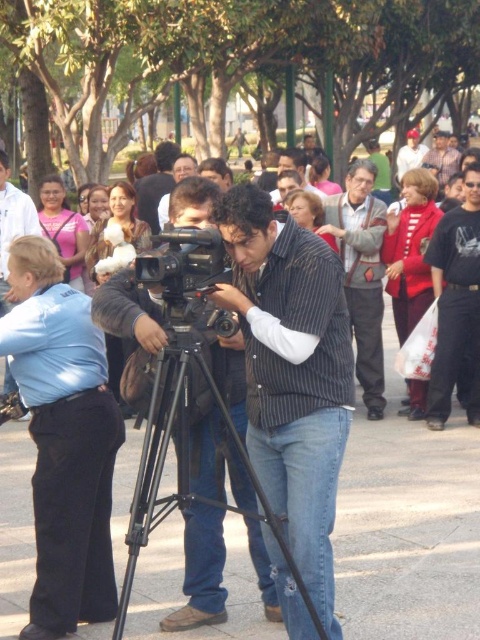
You are a photographer trying to place a small tripod between the denim jeans at center and the black plastic video camera at center. If the tripod requires 30 cm of space, can it fit between them?

The denim jeans at center is wider than the black plastic video camera at center. However, the exact distance between them isn not specified in the objects description. Therefore, it is unclear if the 30 cm space required for the tripod is available.

You are a photographer in the park. You need to place a small tripod exactly at the point marked by the coordinates point (305, 493). However, there is an object at that location. What is the object blocking the tripod placement?

The point point (305, 493) indicates denim jeans at center, so the object blocking the tripod placement is the denim jeans at center.

You are a photographer setting up equipment in the park. You notice the black metal tripod at center and the striped shirt at center. Which object is positioned lower in the scene?

The black metal tripod at center is located below striped shirt at center, so it is positioned lower in the scene.